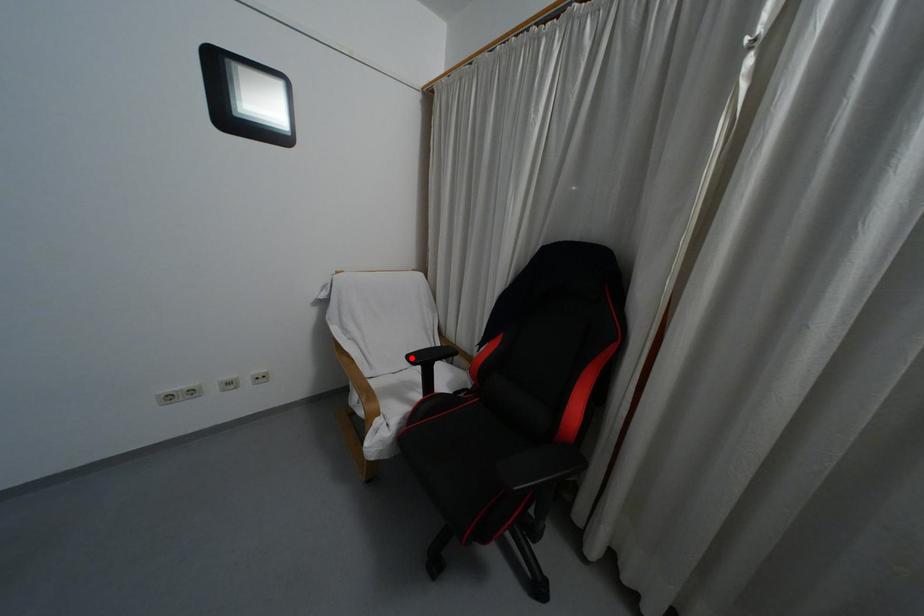
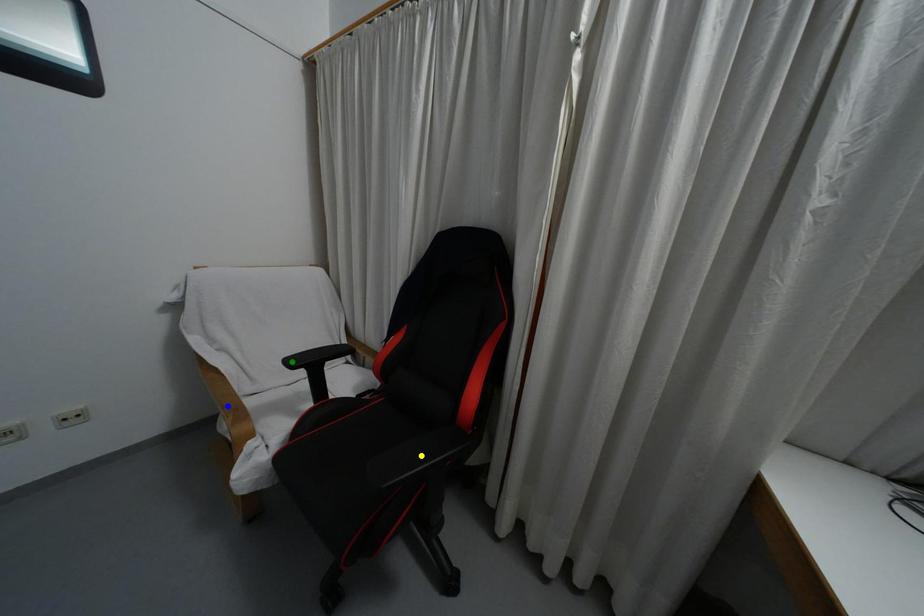
Question: I am providing you with two images of the same scene from different viewpoints. A red point is marked on the first image. You are given multiple points on the second image. Which point in image 2 represents the same 3d spot as the red point in image 1?

Choices:
 (A) blue point
 (B) yellow point
 (C) green point

Answer: (C)